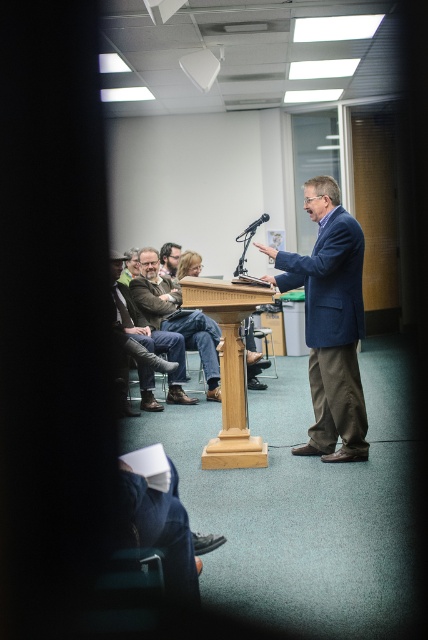
Question: Which of the following is the farthest from the observer?

Choices:
 (A) (165, 321)
 (B) (158, 332)
 (C) (235, 388)

Answer: (A)

Question: Does brown leather jacket at left appear on the right side of matte brown hair at center?

Choices:
 (A) yes
 (B) no

Answer: (B)

Question: Which point is farther to the camera?

Choices:
 (A) light wood podium at center
 (B) brown leather jacket at left

Answer: (B)

Question: Observing the image, what is the correct spatial positioning of brown leather jacket at left in reference to dark brown leather jacket at center?

Choices:
 (A) below
 (B) above

Answer: (A)

Question: Can you confirm if light wood podium at center is wider than dark brown leather jacket at center?

Choices:
 (A) no
 (B) yes

Answer: (A)

Question: Which point is farther from the camera taking this photo?

Choices:
 (A) (249, 291)
 (B) (169, 316)
 (C) (326, 204)
 (D) (121, 259)

Answer: (B)